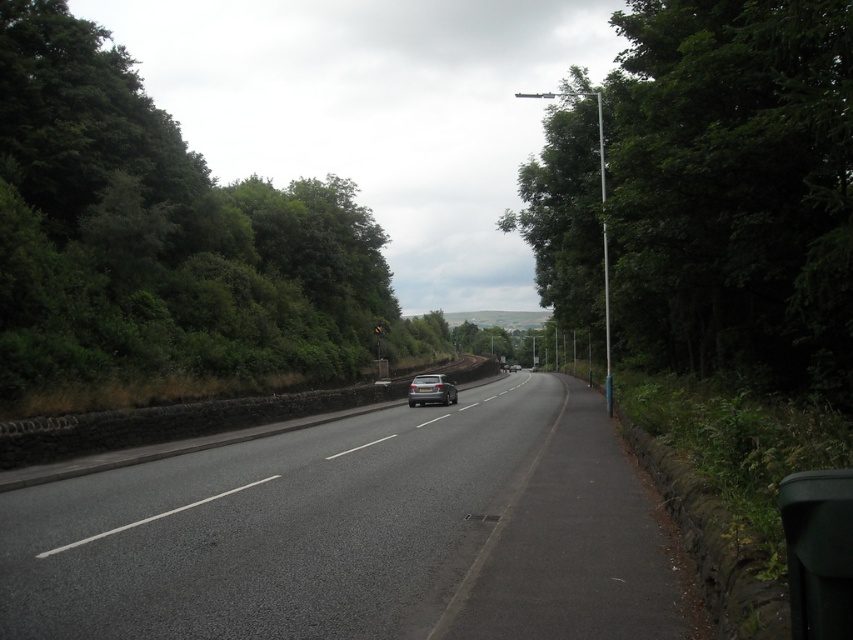
The width and height of the screenshot is (853, 640). What do you see at coordinates (358, 532) in the screenshot?
I see `black asphalt highway at center` at bounding box center [358, 532].

Does black asphalt highway at center appear over satin black car at center?

Incorrect, black asphalt highway at center is not positioned above satin black car at center.

Is point (515, 612) behind point (432, 392)?

No, it is in front of (432, 392).

Where is `black asphalt highway at center`? black asphalt highway at center is located at coordinates (358, 532).

Is green leafy trees at left behind satin black car at center?

No, it is not.

Is point (177, 168) in front of point (428, 403)?

No, (177, 168) is behind (428, 403).

This screenshot has height=640, width=853. I want to click on green leafy trees at left, so click(160, 234).

I want to click on green leafy trees at left, so click(x=160, y=234).

Is green leafy tree at right bigger than green leafy trees at left?

Yes, green leafy tree at right is bigger than green leafy trees at left.

Is green leafy tree at right closer to camera compared to green leafy trees at left?

Yes.

Which is in front, point (659, 348) or point (0, 93)?

Positioned in front is point (659, 348).

Image resolution: width=853 pixels, height=640 pixels. What are the coordinates of `green leafy tree at right` in the screenshot? It's located at (733, 189).